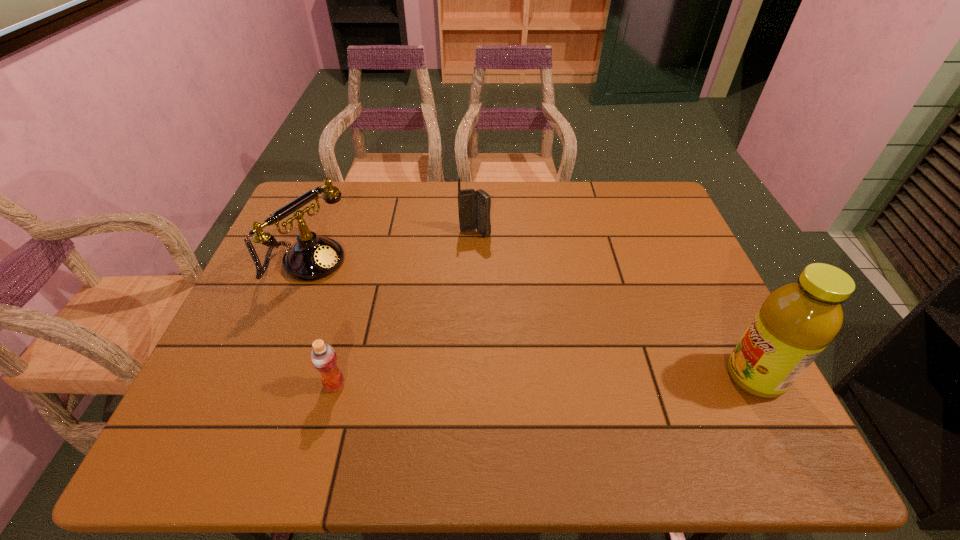
Where is `object that is at the near right corner`? object that is at the near right corner is located at coordinates (797, 321).

I want to click on free spot at the far edge of the desktop, so click(x=404, y=201).

Image resolution: width=960 pixels, height=540 pixels. What are the coordinates of `free spot at the near edge of the desktop` in the screenshot? It's located at (449, 388).

Identify the location of free point at the right edge. (732, 344).

Locate an element on the screen. The height and width of the screenshot is (540, 960). vacant space at the far left corner of the desktop is located at coordinates (345, 200).

Find the location of a particular element. Image resolution: width=960 pixels, height=540 pixels. vacant region at the near right corner of the desktop is located at coordinates (740, 405).

You are a GUI agent. You are given a task and a screenshot of the screen. Output one action in this format:
    pyautogui.click(x=<x>, y=<y>)
    Task: Click on the free space between the leftmost object and the orange juice
    The height and width of the screenshot is (540, 960).
    Given the screenshot: What is the action you would take?
    pyautogui.click(x=321, y=323)

Where is `vacant area that lies between the orange juice and the tallest object`? This screenshot has height=540, width=960. vacant area that lies between the orange juice and the tallest object is located at coordinates (544, 381).

Locate an element on the screen. free spot between the rightmost object and the third object from right to left is located at coordinates (544, 381).

Identify the location of free space between the cellular telephone and the telephone. The width and height of the screenshot is (960, 540). (391, 248).